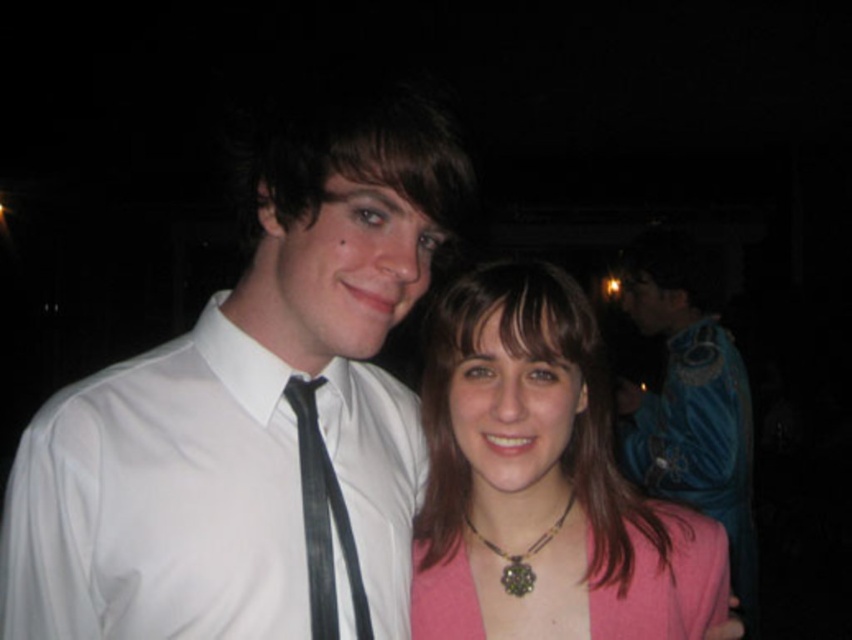
Question: Does white smooth shirt at center have a smaller size compared to pink fabric dress at center?

Choices:
 (A) no
 (B) yes

Answer: (A)

Question: Which object is the closest to the blue velvet robe at right?

Choices:
 (A) white smooth shirt at center
 (B) pink fabric at center
 (C) black satin tie at center

Answer: (B)

Question: Is white smooth shirt at center to the right of multicolored beaded necklace at center from the viewer's perspective?

Choices:
 (A) no
 (B) yes

Answer: (A)

Question: Is pink fabric dress at center to the left of black satin tie at center from the viewer's perspective?

Choices:
 (A) no
 (B) yes

Answer: (A)

Question: Estimate the real-world distances between objects in this image. Which object is closer to the multicolored beaded necklace at center?

Choices:
 (A) pink fabric dress at center
 (B) pink fabric at center
 (C) white smooth shirt at center
 (D) black satin tie at center

Answer: (A)

Question: Among these points, which one is farthest from the camera?

Choices:
 (A) (746, 540)
 (B) (337, 509)
 (C) (459, 397)
 (D) (527, 554)

Answer: (A)